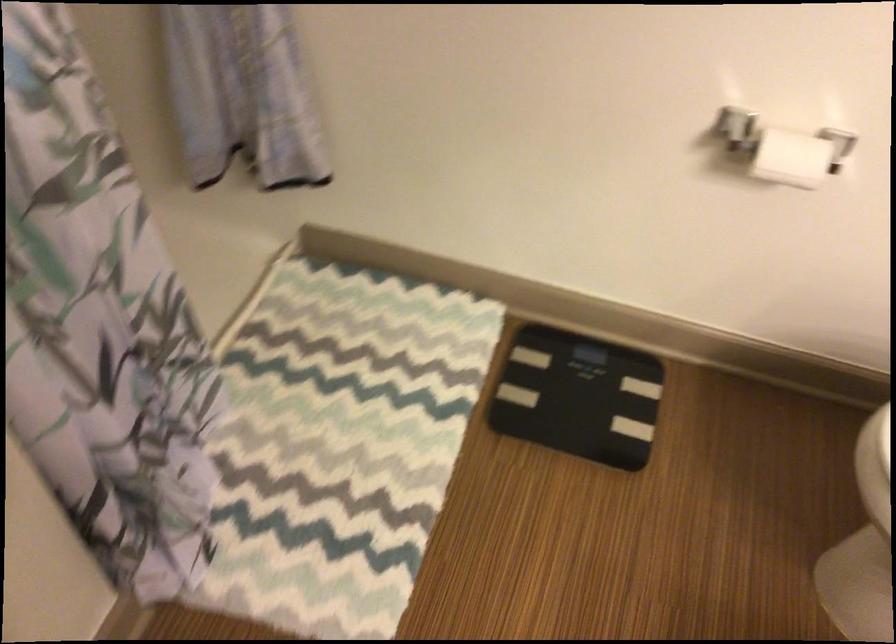
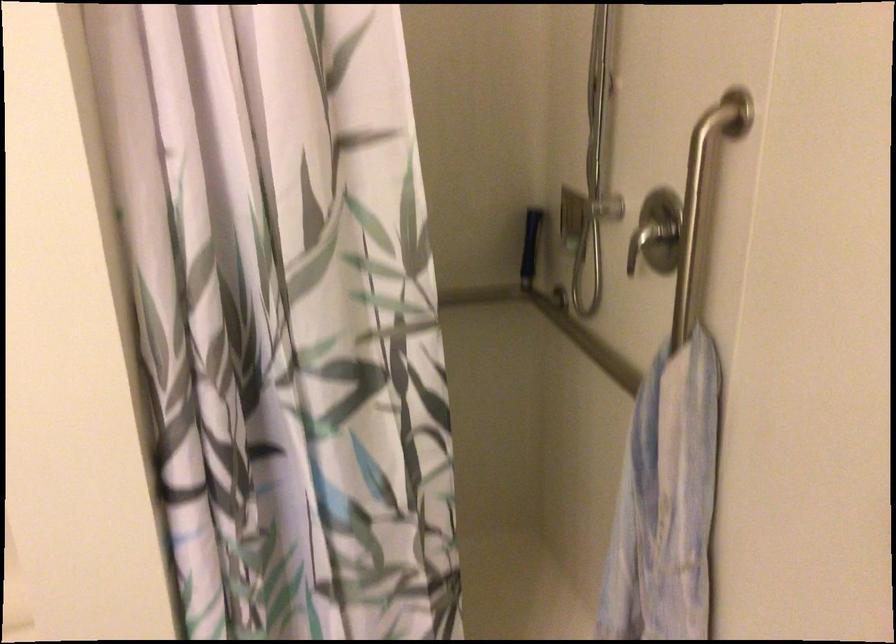
Question: The first image is from the beginning of the video and the second image is from the end. How did the camera likely rotate when shooting the video?

Choices:
 (A) Left
 (B) Right
 (C) Up
 (D) Down

Answer: (A)